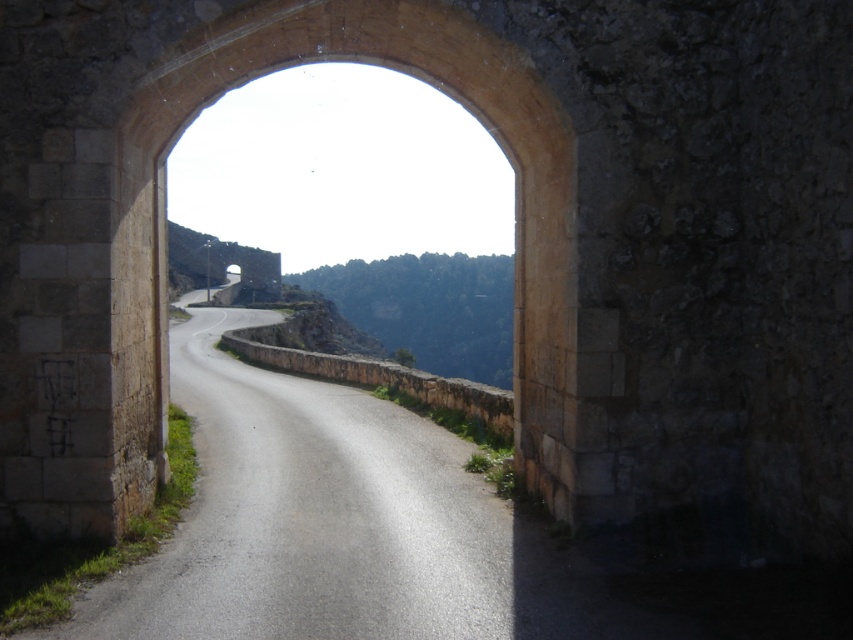
Looking at this image, is asphalt road at center wider than brown stone archway at center?

Yes.

Between asphalt road at center and brown stone archway at center, which one appears on the left side from the viewer's perspective?

From the viewer's perspective, asphalt road at center appears more on the left side.

Where is `asphalt road at center`? The height and width of the screenshot is (640, 853). asphalt road at center is located at coordinates (312, 516).